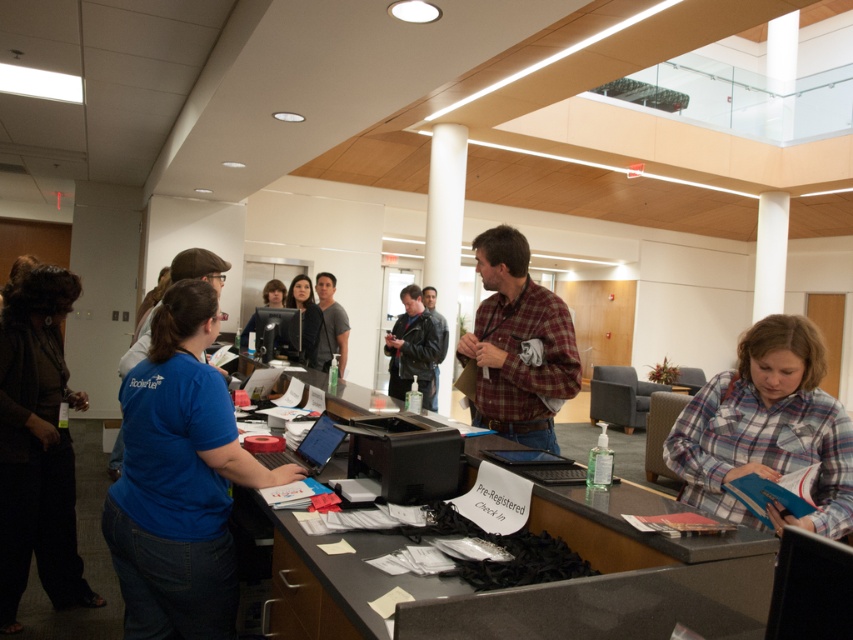
You are an attendee at this event and you see the blue cotton shirt at center and the matte black shirt at center. Which one is positioned lower in the image?

The blue cotton shirt at center is located below the matte black shirt at center, so it is positioned lower in the image.

You are an attendee at the event and need to reach the registration desk. You see the smooth gray desk at center and the matte black shirt at center. Which object is closer to you as you approach from the entrance?

The smooth gray desk at center is closer to you because it is in front of the matte black shirt at center, meaning the desk is positioned nearer to your current location.

You are organizing an event and need to place a 2.5 feet wide registration board on the smooth gray desk at center. Given that the matte black shirt at center is currently on the desk, can the board fit on the desk without overlapping the shirt?

The smooth gray desk at center has a width larger than the matte black shirt at center, so the 2.5 feet wide registration board can fit on the desk without overlapping the shirt as long as it is placed appropriately.